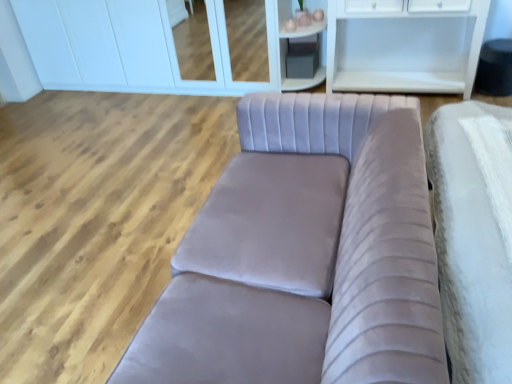
Question: Is the depth of white glossy cabinet at upper center less than that of matte gray cube at upper center?

Choices:
 (A) yes
 (B) no

Answer: (B)

Question: Is white glossy cabinet at upper center facing away from matte gray cube at upper center?

Choices:
 (A) yes
 (B) no

Answer: (B)

Question: Is white glossy cabinet at upper center taller than matte gray cube at upper center?

Choices:
 (A) yes
 (B) no

Answer: (A)

Question: Would you consider white glossy cabinet at upper center to be distant from matte gray cube at upper center?

Choices:
 (A) no
 (B) yes

Answer: (B)

Question: From the image's perspective, would you say white glossy cabinet at upper center is shown under matte gray cube at upper center?

Choices:
 (A) no
 (B) yes

Answer: (A)

Question: Considering the relative sizes of white glossy cabinet at upper center and matte gray cube at upper center in the image provided, is white glossy cabinet at upper center thinner than matte gray cube at upper center?

Choices:
 (A) no
 (B) yes

Answer: (A)

Question: Can you see velvet grey couch at center touching matte gray cube at upper center?

Choices:
 (A) yes
 (B) no

Answer: (B)

Question: Is velvet grey couch at center positioned with its back to matte gray cube at upper center?

Choices:
 (A) no
 (B) yes

Answer: (A)

Question: Does velvet grey couch at center have a lesser width compared to matte gray cube at upper center?

Choices:
 (A) no
 (B) yes

Answer: (A)

Question: From a real-world perspective, is velvet grey couch at center beneath matte gray cube at upper center?

Choices:
 (A) no
 (B) yes

Answer: (B)

Question: Is velvet grey couch at center smaller than matte gray cube at upper center?

Choices:
 (A) yes
 (B) no

Answer: (B)

Question: From the image's perspective, is velvet grey couch at center above matte gray cube at upper center?

Choices:
 (A) yes
 (B) no

Answer: (B)

Question: Can you confirm if white glossy cabinet at upper center is wider than velvet grey couch at center?

Choices:
 (A) yes
 (B) no

Answer: (B)